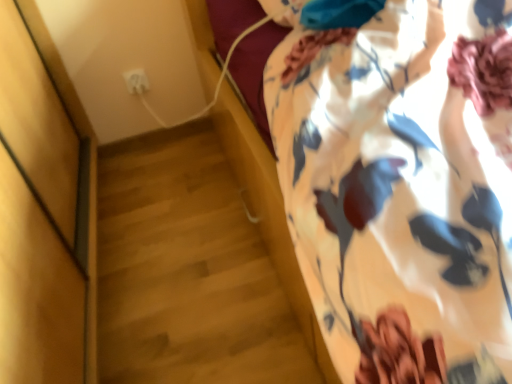
Question: Is the depth of floral fabric curtain at upper right greater than that of white plastic outlet at upper left?

Choices:
 (A) yes
 (B) no

Answer: (B)

Question: Can you confirm if floral fabric curtain at upper right is taller than white plastic outlet at upper left?

Choices:
 (A) no
 (B) yes

Answer: (B)

Question: Does floral fabric curtain at upper right have a smaller size compared to white plastic outlet at upper left?

Choices:
 (A) yes
 (B) no

Answer: (B)

Question: Could you tell me if floral fabric curtain at upper right is turned towards white plastic outlet at upper left?

Choices:
 (A) yes
 (B) no

Answer: (B)

Question: Are floral fabric curtain at upper right and white plastic outlet at upper left located far from each other?

Choices:
 (A) yes
 (B) no

Answer: (A)

Question: Does floral fabric curtain at upper right have a greater width compared to white plastic outlet at upper left?

Choices:
 (A) no
 (B) yes

Answer: (B)

Question: From the image's perspective, does white plastic outlet at upper left appear higher than floral fabric curtain at upper right?

Choices:
 (A) no
 (B) yes

Answer: (B)

Question: Is white plastic outlet at upper left completely or partially outside of floral fabric curtain at upper right?

Choices:
 (A) yes
 (B) no

Answer: (A)

Question: Is white plastic outlet at upper left wider than floral fabric curtain at upper right?

Choices:
 (A) no
 (B) yes

Answer: (A)

Question: Does white plastic outlet at upper left turn towards floral fabric curtain at upper right?

Choices:
 (A) no
 (B) yes

Answer: (A)

Question: From a real-world perspective, is white plastic outlet at upper left beneath floral fabric curtain at upper right?

Choices:
 (A) no
 (B) yes

Answer: (B)

Question: Is white plastic outlet at upper left to the right of floral fabric curtain at upper right from the viewer's perspective?

Choices:
 (A) yes
 (B) no

Answer: (B)

Question: In terms of size, does floral fabric curtain at upper right appear bigger or smaller than white plastic outlet at upper left?

Choices:
 (A) big
 (B) small

Answer: (A)